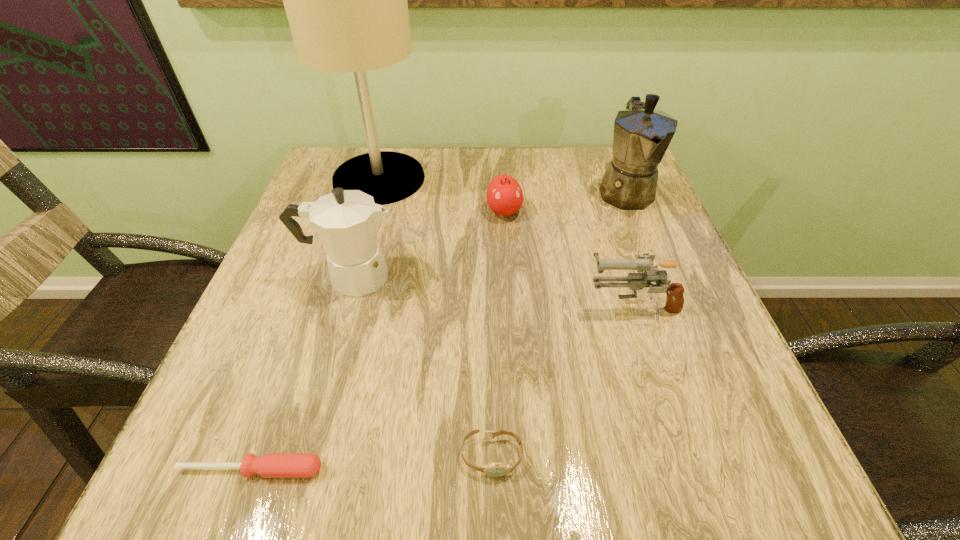
You are a GUI agent. You are given a task and a screenshot of the screen. Output one action in this format:
    pyautogui.click(x=<x>, y=<y>)
    Task: Click on the screwdriver present at the near edge
    
    Given the screenshot: What is the action you would take?
    pyautogui.click(x=269, y=465)

At what (x,y) coordinates should I click in order to perform the action: click on table lamp that is at the left edge. Please return your answer as a coordinate pair (x, y). Looking at the image, I should click on [346, 2].

At what (x,y) coordinates should I click in order to perform the action: click on coffeepot located in the left edge section of the desktop. Please return your answer as a coordinate pair (x, y). The image size is (960, 540). Looking at the image, I should click on (346, 221).

This screenshot has height=540, width=960. Find the location of `screwdriver present at the left edge`. screwdriver present at the left edge is located at coordinates (269, 465).

At what (x,y) coordinates should I click in order to perform the action: click on coffeepot present at the right edge. Please return your answer as a coordinate pair (x, y). Looking at the image, I should click on [x=642, y=135].

The height and width of the screenshot is (540, 960). In order to click on gun present at the right edge in this screenshot , I will do `click(635, 281)`.

Find the location of `object that is at the far left corner`. object that is at the far left corner is located at coordinates (346, 2).

You are a GUI agent. You are given a task and a screenshot of the screen. Output one action in this format:
    pyautogui.click(x=<x>, y=<y>)
    Task: Click on the object that is positioned at the near left corner
    The height and width of the screenshot is (540, 960).
    Given the screenshot: What is the action you would take?
    pyautogui.click(x=269, y=465)

At what (x,y) coordinates should I click in order to perform the action: click on object positioned at the far right corner. Please return your answer as a coordinate pair (x, y). The width and height of the screenshot is (960, 540). Looking at the image, I should click on (642, 135).

This screenshot has width=960, height=540. Find the location of `vacant space at the far edge of the desktop`. vacant space at the far edge of the desktop is located at coordinates (491, 180).